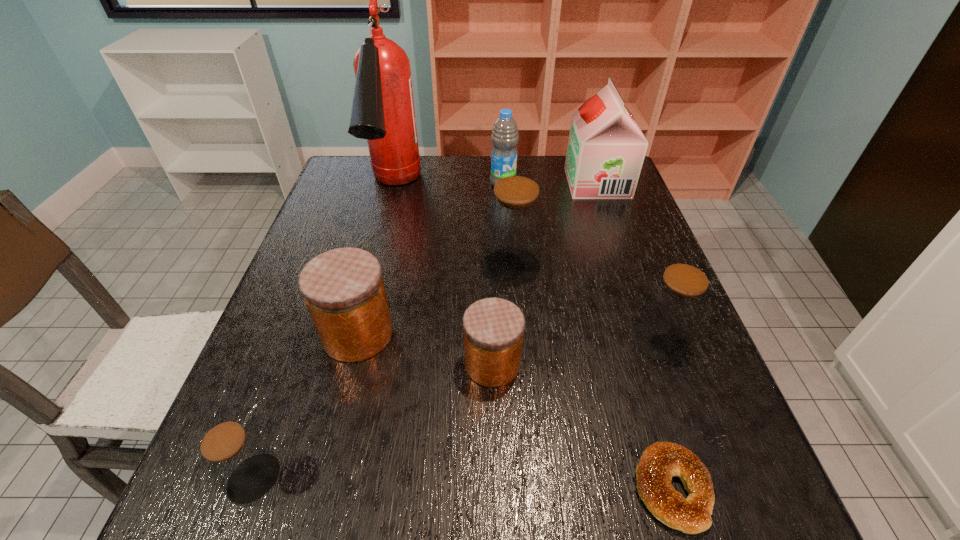
Locate an element on the screen. fire extinguisher positioned at the left edge is located at coordinates (383, 112).

Image resolution: width=960 pixels, height=540 pixels. Find the location of `soya milk that is at the right edge`. soya milk that is at the right edge is located at coordinates (606, 148).

This screenshot has height=540, width=960. I want to click on jar located in the right edge section of the desktop, so click(675, 304).

At what (x,y) coordinates should I click in order to perform the action: click on bagel present at the right edge. Please return your answer as a coordinate pair (x, y). This screenshot has width=960, height=540. Looking at the image, I should click on (660, 461).

Image resolution: width=960 pixels, height=540 pixels. I want to click on object that is at the far left corner, so click(383, 112).

You are a GUI agent. You are given a task and a screenshot of the screen. Output one action in this format:
    pyautogui.click(x=<x>, y=<y>)
    Task: Click on the object that is at the near left corner
    Image resolution: width=960 pixels, height=540 pixels.
    Given the screenshot: What is the action you would take?
    pyautogui.click(x=236, y=458)

The image size is (960, 540). Find the location of `object present at the far right corner`. object present at the far right corner is located at coordinates (606, 148).

The height and width of the screenshot is (540, 960). In order to click on object located at the near right corner in this screenshot , I will do `click(660, 461)`.

I want to click on vacant space at the far edge, so pyautogui.click(x=525, y=171).

The height and width of the screenshot is (540, 960). Find the location of `vacant space at the near edge of the desktop`. vacant space at the near edge of the desktop is located at coordinates (597, 491).